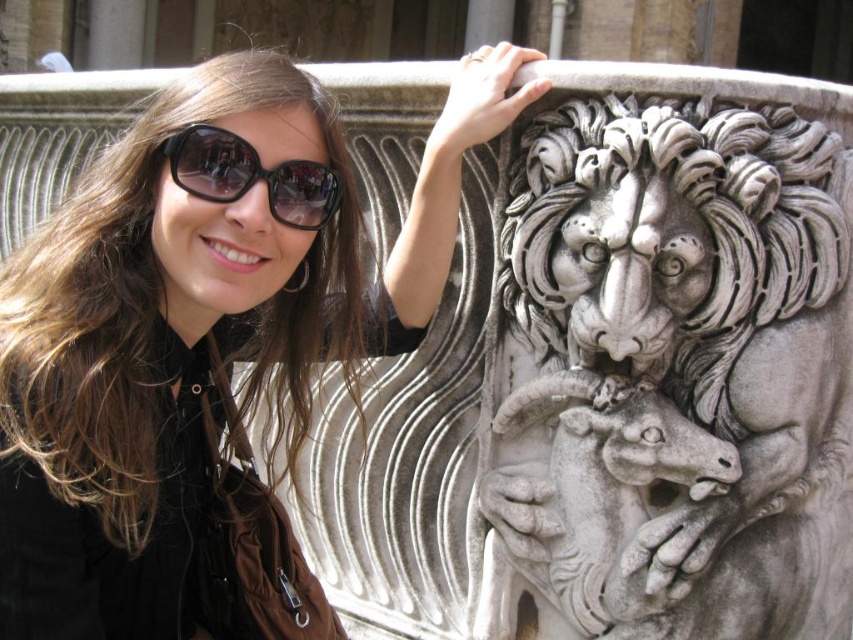
Is point (138, 490) positioned in front of point (242, 156)?

That is True.

Which is in front, point (44, 484) or point (254, 157)?

Point (44, 484)

This screenshot has width=853, height=640. I want to click on matte black jacket at upper left, so click(202, 348).

Which is behind, point (807, 573) or point (270, 209)?

The point (807, 573) is more distant.

Who is positioned more to the right, white marble lion at upper center or black glossy sunglasses at upper center?

white marble lion at upper center is more to the right.

Is point (699, 196) positioned after point (213, 134)?

Yes, it is.

Where is `white marble lion at upper center`? The width and height of the screenshot is (853, 640). white marble lion at upper center is located at coordinates (674, 376).

Is white marble lion at upper center bigger than matte black jacket at upper left?

Incorrect, white marble lion at upper center is not larger than matte black jacket at upper left.

At what (x,y) coordinates should I click in order to perform the action: click on white marble lion at upper center. Please return your answer as a coordinate pair (x, y). This screenshot has height=640, width=853. Looking at the image, I should click on (674, 376).

Does point (660, 432) come farther from viewer compared to point (96, 225)?

Yes.

The width and height of the screenshot is (853, 640). Identify the location of white marble lion at upper center. (674, 376).